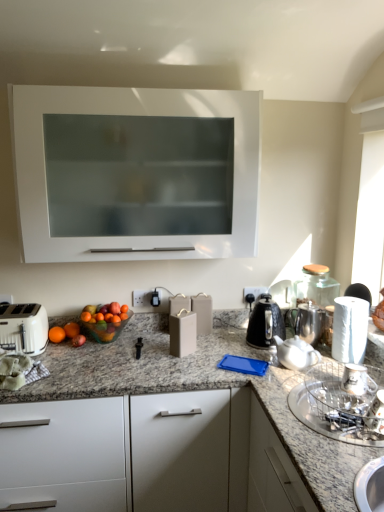
Question: Can you confirm if black metallic kettle at right is shorter than satin silver coffee pot at right?

Choices:
 (A) no
 (B) yes

Answer: (A)

Question: Does black metallic kettle at right have a larger size compared to satin silver coffee pot at right?

Choices:
 (A) yes
 (B) no

Answer: (A)

Question: Is black metallic kettle at right positioned with its back to satin silver coffee pot at right?

Choices:
 (A) yes
 (B) no

Answer: (A)

Question: Would you say black metallic kettle at right is a long distance from satin silver coffee pot at right?

Choices:
 (A) no
 (B) yes

Answer: (A)

Question: From the image's perspective, is black metallic kettle at right located beneath satin silver coffee pot at right?

Choices:
 (A) yes
 (B) no

Answer: (B)

Question: From a real-world perspective, relative to white matte cabinet at upper center, which appears as the 2th cabinetry when ordered from the bottom, is white paper towel at right vertically above or below?

Choices:
 (A) below
 (B) above

Answer: (A)

Question: From the image's perspective, is white paper towel at right above or below white matte cabinet at upper center, which appears as the 2th cabinetry when ordered from the bottom?

Choices:
 (A) above
 (B) below

Answer: (B)

Question: Is white paper towel at right wider or thinner than white matte cabinet at upper center, which appears as the 2th cabinetry when ordered from the bottom?

Choices:
 (A) thin
 (B) wide

Answer: (A)

Question: Considering their positions, is white paper towel at right located in front of or behind white matte cabinet at upper center, positioned as the first cabinetry in top-to-bottom order?

Choices:
 (A) behind
 (B) front

Answer: (A)

Question: From a real-world perspective, is white matte cabinet at upper center, positioned as the first cabinetry in top-to-bottom order, physically located above or below metallic silver cup at lower right, acting as the 1th appliance starting from the right?

Choices:
 (A) above
 (B) below

Answer: (A)

Question: In terms of height, does white matte cabinet at upper center, which appears as the 2th cabinetry when ordered from the bottom, look taller or shorter compared to metallic silver cup at lower right, which is counted as the 2th appliance, starting from the back?

Choices:
 (A) tall
 (B) short

Answer: (A)

Question: From the image's perspective, is white matte cabinet at upper center, positioned as the first cabinetry in top-to-bottom order, positioned above or below metallic silver cup at lower right, which is the third appliance from left to right?

Choices:
 (A) below
 (B) above

Answer: (B)

Question: Visually, is white matte cabinet at upper center, positioned as the first cabinetry in top-to-bottom order, positioned to the left or to the right of metallic silver cup at lower right, which is counted as the 2th appliance, starting from the back?

Choices:
 (A) left
 (B) right

Answer: (A)

Question: Looking at their shapes, would you say white paper towel at right is wider or thinner than white plastic toaster at lower left?

Choices:
 (A) thin
 (B) wide

Answer: (A)

Question: Considering the positions of white paper towel at right and white plastic toaster at lower left in the image, is white paper towel at right taller or shorter than white plastic toaster at lower left?

Choices:
 (A) short
 (B) tall

Answer: (B)